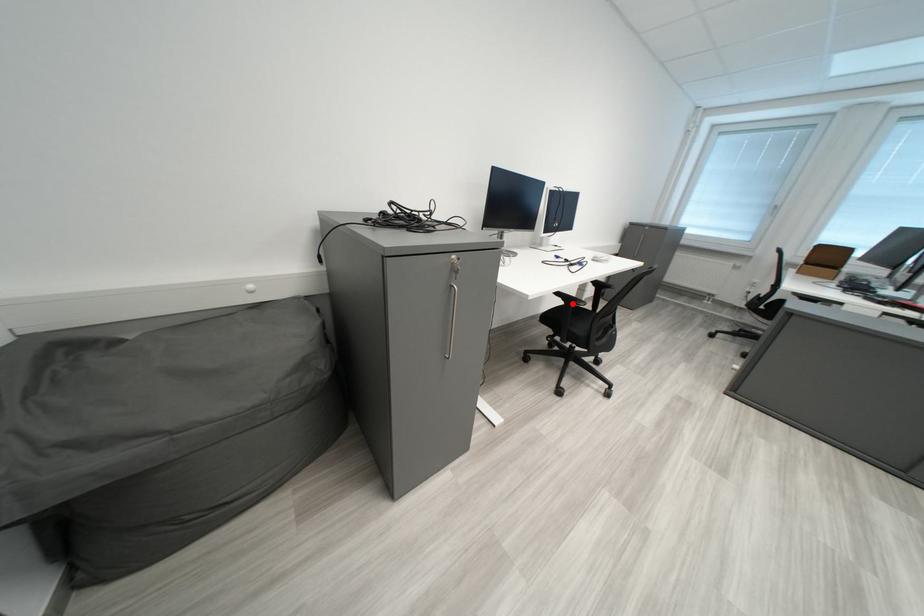
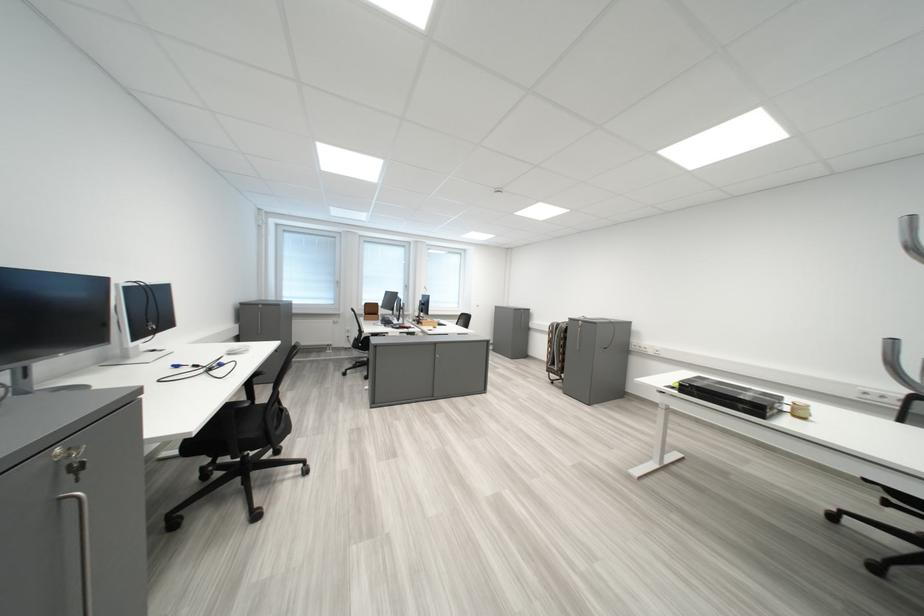
Question: I am providing you with two images of the same scene from different viewpoints. A red point is marked on the first image. Can you still see the location of the red point in image 2?

Choices:
 (A) Yes
 (B) No

Answer: (B)